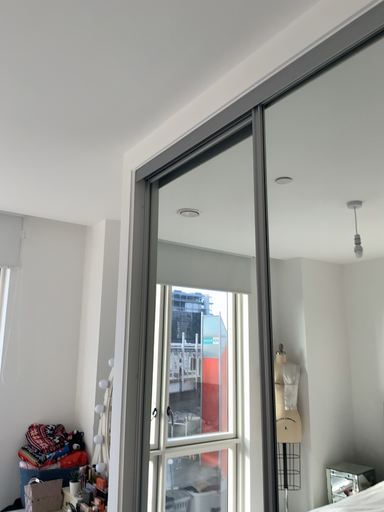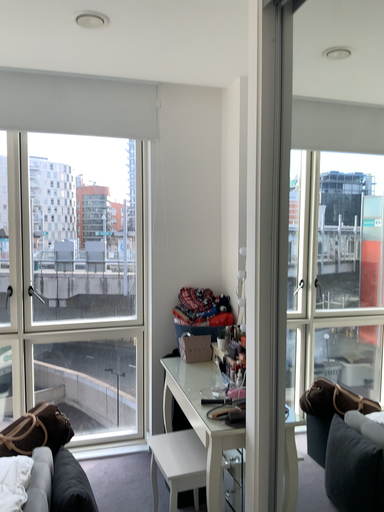
Question: How did the camera likely rotate when shooting the video?

Choices:
 (A) rotated downward
 (B) rotated upward

Answer: (A)